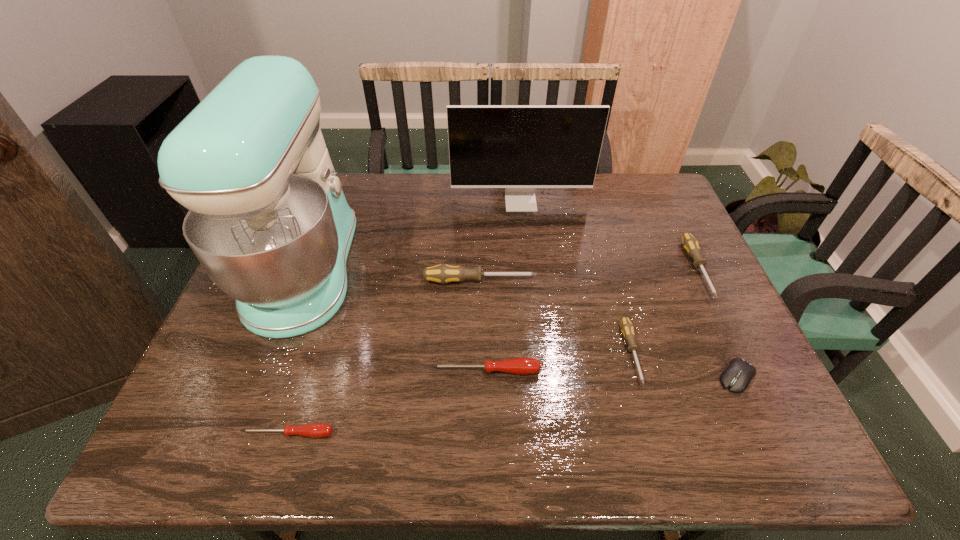
Find the location of `object located at the far left corner`. object located at the far left corner is located at coordinates (268, 220).

At what (x,y) coordinates should I click in order to perform the action: click on object situated at the near left corner. Please return your answer as a coordinate pair (x, y). Image resolution: width=960 pixels, height=540 pixels. Looking at the image, I should click on (315, 430).

The height and width of the screenshot is (540, 960). In the image, there is a desktop. What are the coordinates of `free space at the far edge` in the screenshot? It's located at (367, 185).

Image resolution: width=960 pixels, height=540 pixels. Find the location of `vacant space at the near edge of the desktop`. vacant space at the near edge of the desktop is located at coordinates (305, 415).

At what (x,y) coordinates should I click in order to perform the action: click on free point at the right edge. Please return your answer as a coordinate pair (x, y). This screenshot has height=540, width=960. Looking at the image, I should click on (672, 317).

In the image, there is a desktop. What are the coordinates of `vacant space at the far right corner` in the screenshot? It's located at (634, 208).

This screenshot has height=540, width=960. I want to click on empty location between the sixth shortest object and the light mixer, so click(x=393, y=275).

Locate an element on the screen. The height and width of the screenshot is (540, 960). unoccupied area between the biggest gray screwdriver and the computer equipment is located at coordinates (609, 329).

Where is `vacant area that lies between the computer equipment and the second gray screwdriver from left to right`? The width and height of the screenshot is (960, 540). vacant area that lies between the computer equipment and the second gray screwdriver from left to right is located at coordinates (684, 365).

In order to click on empty location between the rightmost screwdriver and the farthest object in this screenshot , I will do `click(609, 235)`.